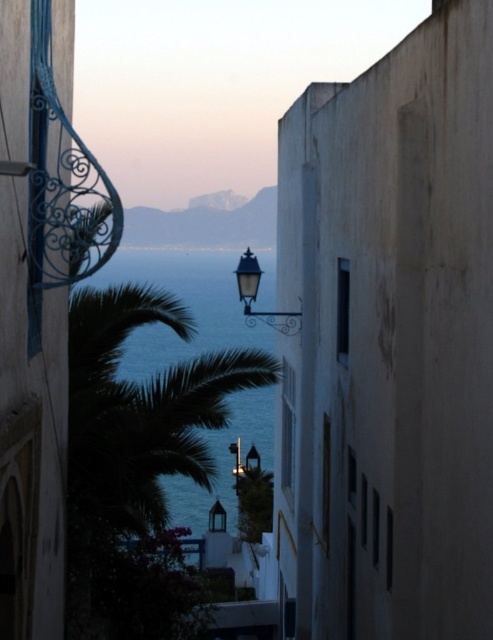
Can you confirm if blue water at center is thinner than polished brass streetlamp at center?

No.

At what (x,y) coordinates should I click in order to perform the action: click on blue water at center. Please return your answer as a coordinate pair (x, y). The image size is (493, 640). Looking at the image, I should click on (156, 403).

At what (x,y) coordinates should I click in order to perform the action: click on blue water at center. Please return your answer as a coordinate pair (x, y). Looking at the image, I should click on (156, 403).